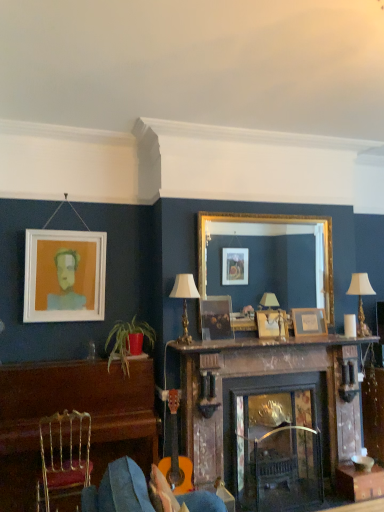
Find the location of `vacant region below matte white picture frame at left, placed as the 4th picture frame when sorted from right to left (from a real-world perspective)`. vacant region below matte white picture frame at left, placed as the 4th picture frame when sorted from right to left (from a real-world perspective) is located at coordinates (55, 357).